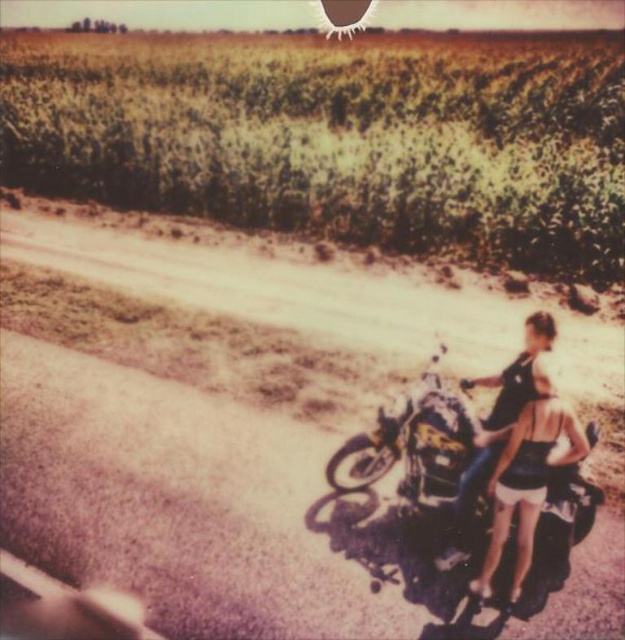
Does shiny chrome motorcycle at lower right appear under matte black motorcycle at right?

Indeed, shiny chrome motorcycle at lower right is positioned under matte black motorcycle at right.

Can you confirm if shiny chrome motorcycle at lower right is taller than matte black motorcycle at right?

No, shiny chrome motorcycle at lower right is not taller than matte black motorcycle at right.

What are the coordinates of `shiny chrome motorcycle at lower right` in the screenshot? It's located at (426, 440).

Where is `shiny chrome motorcycle at lower right`? This screenshot has height=640, width=625. shiny chrome motorcycle at lower right is located at coordinates (426, 440).

Image resolution: width=625 pixels, height=640 pixels. What are the coordinates of `green grass at upper center` in the screenshot? It's located at (338, 138).

Is point (456, 179) behind point (528, 552)?

Yes, point (456, 179) is farther from viewer.

Where is `green grass at upper center`? green grass at upper center is located at coordinates (338, 138).

Does point (191, 38) come farther from viewer compared to point (471, 458)?

Yes, point (191, 38) is farther from viewer.

Can you confirm if green grass at upper center is positioned below shiny chrome motorcycle at lower right?

Actually, green grass at upper center is above shiny chrome motorcycle at lower right.

Locate an element on the screen. The height and width of the screenshot is (640, 625). green grass at upper center is located at coordinates [x=338, y=138].